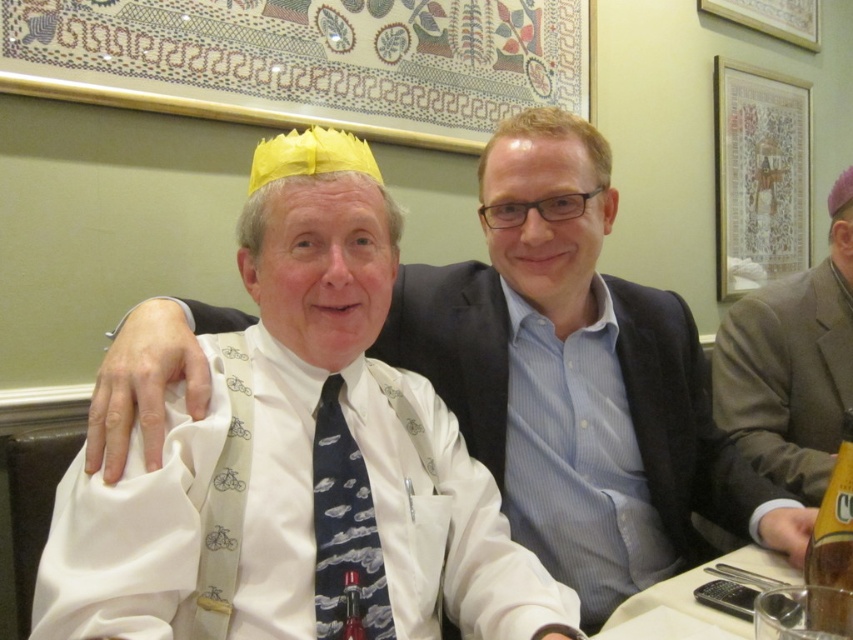
You are taking a photo of the two people at the table. You want to focus on the person closer to the camera. Which point should you focus on, point [614,392] or point [834,580]?

Point [614,392] is further to the camera than point [834,580], so you should focus on point [614,392] to capture the person closer to the camera.

You are a photographer trying to capture a closeup of the amber glass bottle at lower right without the matte yellow paper crown at upper left blocking the view. Can you position yourself in a way that the crown is out of frame while still getting a clear shot of the bottle?

The matte yellow paper crown at upper left is much taller than the amber glass bottle at lower right. Since the crown is taller, positioning yourself lower might allow you to frame the shot so the crown doesn

You are a photographer standing in front of this image. You want to place a sticker exactly at the coordinates mentioned in the description of the matte yellow paper crown at upper left. What are the coordinates where you should place the sticker?

The coordinates for the matte yellow paper crown at upper left are at point [578,378].